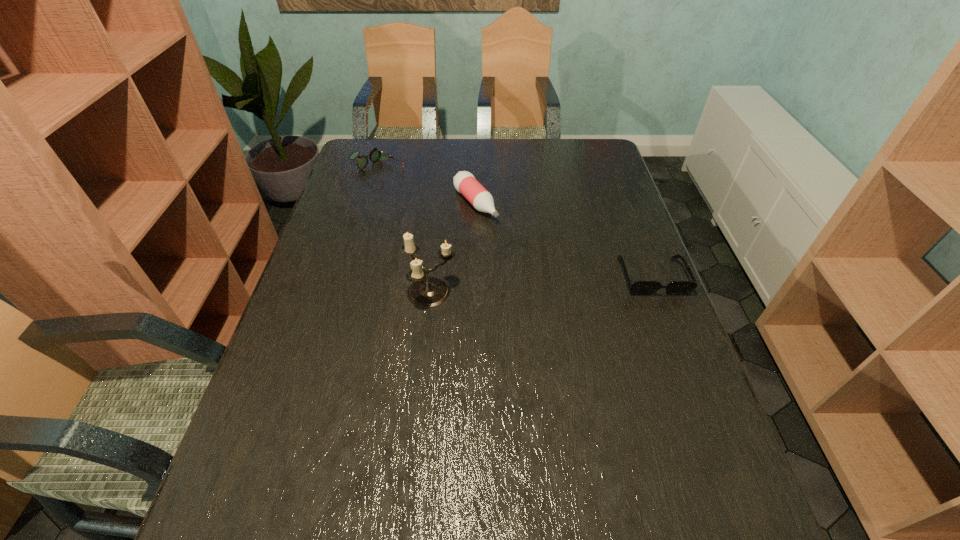
Locate an element on the screen. The height and width of the screenshot is (540, 960). vacant space situated with the cap open on the second tallest object is located at coordinates (496, 232).

This screenshot has height=540, width=960. In order to click on free space located 0.200m on the front-facing side of the leftmost object in this screenshot , I will do `click(437, 204)`.

Identify the location of blank area located on the front-facing side of the leftmost object. The image size is (960, 540). (468, 222).

Locate an element on the screen. free spot located on the front-facing side of the leftmost object is located at coordinates (432, 201).

Find the location of a particular element. object located in the far edge section of the desktop is located at coordinates (375, 154).

You are a GUI agent. You are given a task and a screenshot of the screen. Output one action in this format:
    pyautogui.click(x=<x>, y=<y>)
    Task: Click on the object that is at the left edge
    
    Given the screenshot: What is the action you would take?
    pyautogui.click(x=375, y=154)

Locate an element on the screen. object located at the right edge is located at coordinates (638, 287).

Identify the location of object that is positioned at the far left corner. (375, 154).

Find the location of a particular element. This screenshot has width=960, height=540. free point at the far edge is located at coordinates (405, 151).

The image size is (960, 540). I want to click on vacant region at the near edge, so click(x=544, y=441).